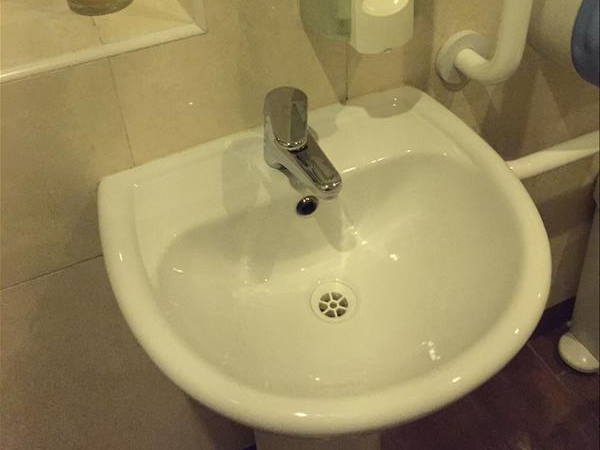
Locate an element on the screen. This screenshot has height=450, width=600. mirror is located at coordinates (92, 35).